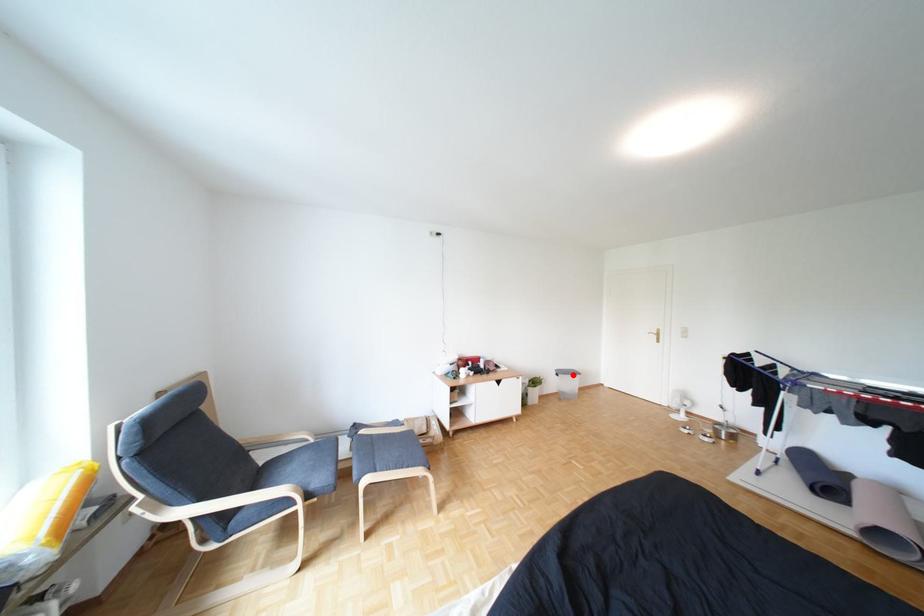
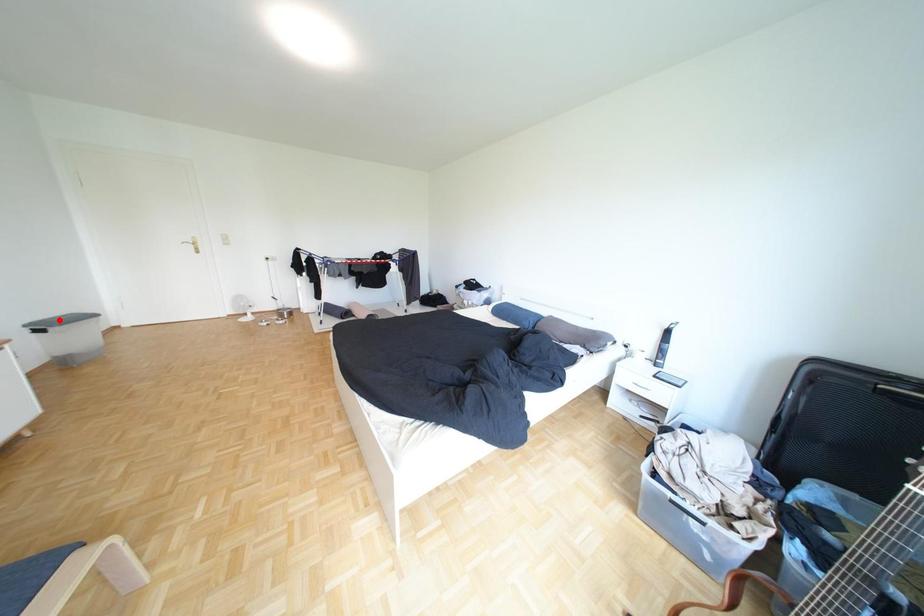
I am providing you with two images of the same scene from different viewpoints. A red point is marked on the first image and another point is marked on the second image. Is the marked point in image1 the same physical position as the marked point in image2?

No